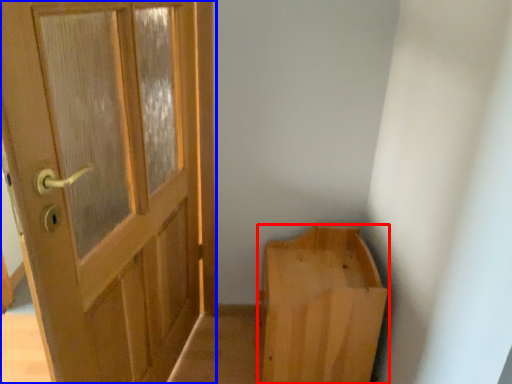
Question: Which object is closer to the camera taking this photo, furniture (highlighted by a red box) or door (highlighted by a blue box)?

Choices:
 (A) furniture
 (B) door

Answer: (B)